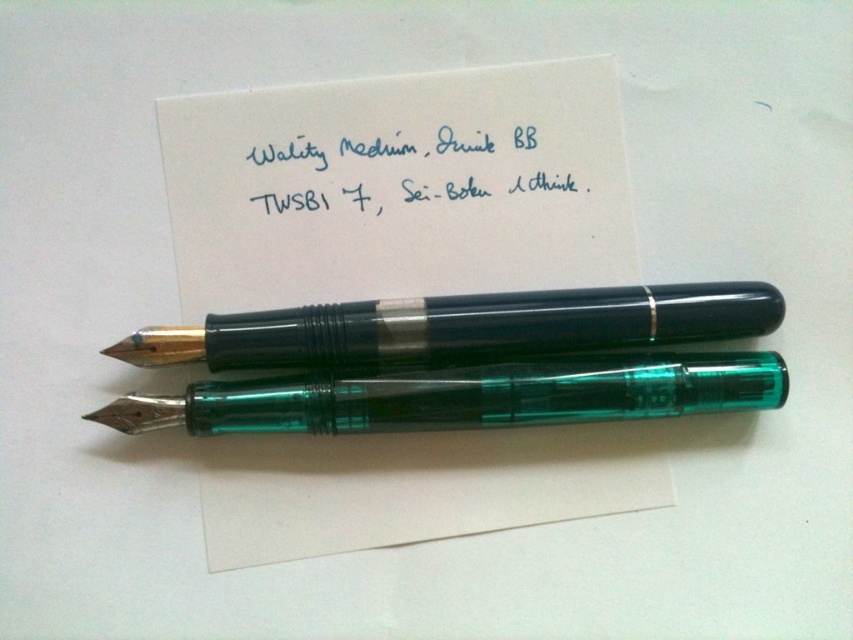
Looking at this image, you are organizing a stationery display and need to place a new item between the black translucent pen at center and the transparent green pen at center. Based on their positions, which pen should you place the new item closer to?

You should place the new item closer to the transparent green pen at center because the black translucent pen at center is closer to you than the transparent green pen at center, so the transparent green pen is further away and the new item should be placed between them accordingly.

You are an office worker who needs to choose between the black translucent pen at center and the transparent green pen at center. Which pen should you pick if you want the one that can hold more ink?

The black translucent pen at center is bigger than the transparent green pen at center, so it can hold more ink.

Based on the photo, you are an office worker who needs to read the note written on the white paper at center. However, there is a blue ink writing at upper center above it. Can you read the note clearly without moving any objects?

The white paper at center is positioned under blue ink writing at upper center, so the blue ink writing at upper center is blocking the view of the white paper at center. Therefore, you cannot read the note clearly without moving the blue ink writing at upper center.